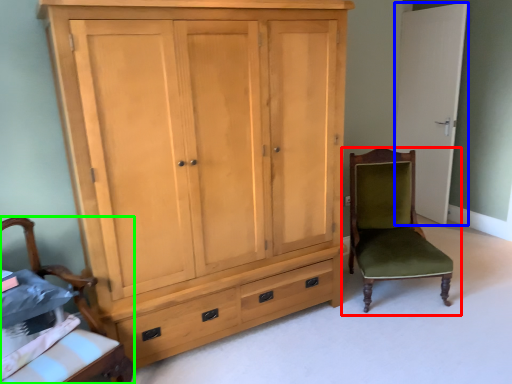
Question: Which object is the farthest from chair (highlighted by a red box)? Choose among these: door (highlighted by a blue box) or chair (highlighted by a green box).

Choices:
 (A) door
 (B) chair

Answer: (B)